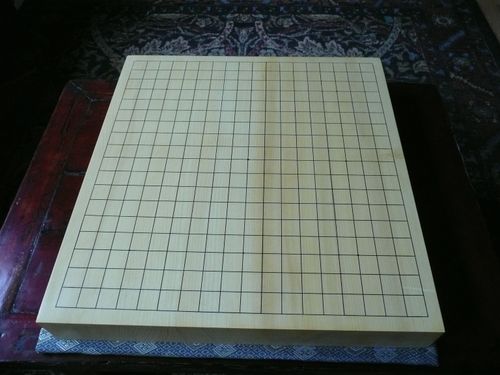
Image resolution: width=500 pixels, height=375 pixels. I want to click on table top, so click(58, 173).